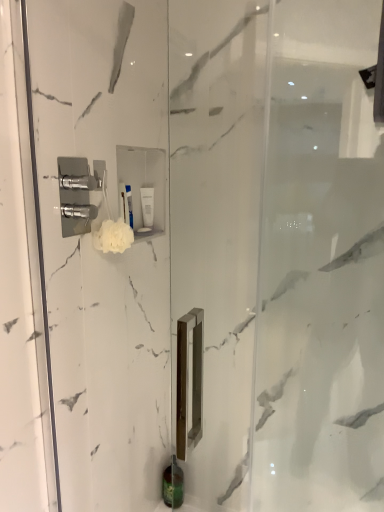
At what (x,y) coordinates should I click in order to perform the action: click on green matte bottle at lower center, the 1th toiletry in the bottom-to-top sequence. Please return your answer as a coordinate pair (x, y). This screenshot has width=384, height=512. Looking at the image, I should click on (173, 485).

You are a GUI agent. You are given a task and a screenshot of the screen. Output one action in this format:
    pyautogui.click(x=<x>, y=<y>)
    Task: Click on the white fluffy sponge at upper center
    The image size is (384, 512).
    Given the screenshot: What is the action you would take?
    pyautogui.click(x=113, y=236)

Find the location of `green matte bottle at lower center, the 1th toiletry from the right`. green matte bottle at lower center, the 1th toiletry from the right is located at coordinates (173, 485).

Which is behind, white matte tube at upper center, the 1th toiletry viewed from the left, or green matte bottle at lower center, placed as the 1th toiletry when sorted from back to front?

Positioned behind is green matte bottle at lower center, placed as the 1th toiletry when sorted from back to front.

Is white matte tube at upper center, which is counted as the second toiletry, starting from the bottom, in contact with green matte bottle at lower center, which appears as the 2th toiletry when viewed from the top?

white matte tube at upper center, which is counted as the second toiletry, starting from the bottom, and green matte bottle at lower center, which appears as the 2th toiletry when viewed from the top, are clearly separated.

Is point (148, 202) closer or farther from the camera than point (177, 488)?

Point (148, 202) is closer to the camera than point (177, 488).

Considering the sizes of white matte tube at upper center, which is counted as the second toiletry, starting from the bottom, and green matte bottle at lower center, placed as the 1th toiletry when sorted from back to front, in the image, is white matte tube at upper center, which is counted as the second toiletry, starting from the bottom, taller or shorter than green matte bottle at lower center, placed as the 1th toiletry when sorted from back to front,?

white matte tube at upper center, which is counted as the second toiletry, starting from the bottom, is taller than green matte bottle at lower center, placed as the 1th toiletry when sorted from back to front.

Find the location of `toiletry that appears above the white fluffy sponge at upper center (from a real-world perspective)`. toiletry that appears above the white fluffy sponge at upper center (from a real-world perspective) is located at coordinates (147, 206).

Can you confirm if white fluffy sponge at upper center is positioned to the left of white matte tube at upper center, the 2th toiletry when ordered from right to left?

Correct, you'll find white fluffy sponge at upper center to the left of white matte tube at upper center, the 2th toiletry when ordered from right to left.

From the image's perspective, between white fluffy sponge at upper center and white matte tube at upper center, the 2th toiletry when ordered from right to left, who is located below?

white fluffy sponge at upper center is shown below in the image.

Consider the image. How many degrees apart are the facing directions of white fluffy sponge at upper center and white matte tube at upper center, which is the second toiletry in back-to-front order?

0.00713 degrees.

From the image's perspective, which is below, green matte bottle at lower center, the 1th toiletry from the right, or white matte tube at upper center, the 1th toiletry viewed from the left?

green matte bottle at lower center, the 1th toiletry from the right, is shown below in the image.

Consider the image. Does green matte bottle at lower center, arranged as the second toiletry when viewed from the front, appear on the left side of white matte tube at upper center, the 2th toiletry when ordered from right to left?

In fact, green matte bottle at lower center, arranged as the second toiletry when viewed from the front, is to the right of white matte tube at upper center, the 2th toiletry when ordered from right to left.

Is green matte bottle at lower center, the 1th toiletry in the bottom-to-top sequence, oriented towards white matte tube at upper center, the 2th toiletry when ordered from right to left?

No.

In the scene shown: From their relative heights in the image, would you say white matte tube at upper center, the 1th toiletry viewed from the left, is taller or shorter than white fluffy sponge at upper center?

Considering their sizes, white matte tube at upper center, the 1th toiletry viewed from the left, has more height than white fluffy sponge at upper center.

Where is `flower below the white matte tube at upper center, the first toiletry in the front-to-back sequence (from a real-world perspective)`? The height and width of the screenshot is (512, 384). flower below the white matte tube at upper center, the first toiletry in the front-to-back sequence (from a real-world perspective) is located at coordinates (113, 236).

Consider the image. Considering the relative positions of white matte tube at upper center, which is the second toiletry in back-to-front order, and white fluffy sponge at upper center in the image provided, is white matte tube at upper center, which is the second toiletry in back-to-front order, to the left of white fluffy sponge at upper center from the viewer's perspective?

Incorrect, white matte tube at upper center, which is the second toiletry in back-to-front order, is not on the left side of white fluffy sponge at upper center.

Is white matte tube at upper center, placed as the 1th toiletry when sorted from top to bottom, oriented away from white fluffy sponge at upper center?

No, white matte tube at upper center, placed as the 1th toiletry when sorted from top to bottom, is not facing the opposite direction of white fluffy sponge at upper center.

Considering the sizes of objects green matte bottle at lower center, placed as the 1th toiletry when sorted from back to front, and white fluffy sponge at upper center in the image provided, who is wider, green matte bottle at lower center, placed as the 1th toiletry when sorted from back to front, or white fluffy sponge at upper center?

Wider between the two is green matte bottle at lower center, placed as the 1th toiletry when sorted from back to front.

Choose the correct answer: Is green matte bottle at lower center, arranged as the second toiletry when viewed from the front, inside white fluffy sponge at upper center or outside it?

The correct answer is: outside.

Looking at this image, who is more distant, green matte bottle at lower center, the 1th toiletry from the right, or white fluffy sponge at upper center?

Positioned behind is green matte bottle at lower center, the 1th toiletry from the right.

In the scene shown: Is green matte bottle at lower center, the 1th toiletry in the bottom-to-top sequence, beside white fluffy sponge at upper center?

There is a gap between green matte bottle at lower center, the 1th toiletry in the bottom-to-top sequence, and white fluffy sponge at upper center.

Which of these two, white fluffy sponge at upper center or green matte bottle at lower center, arranged as the second toiletry when viewed from the front, is bigger?

With larger size is green matte bottle at lower center, arranged as the second toiletry when viewed from the front.

Locate an element on the screen. flower positioned vertically above the green matte bottle at lower center, the 1th toiletry in the bottom-to-top sequence (from a real-world perspective) is located at coordinates (113, 236).

Measure the distance from white fluffy sponge at upper center to green matte bottle at lower center, the 1th toiletry from the right.

A distance of 1.20 meters exists between white fluffy sponge at upper center and green matte bottle at lower center, the 1th toiletry from the right.

Consider the image. Which object is thinner, white fluffy sponge at upper center or green matte bottle at lower center, which is the 2th toiletry in left-to-right order?

white fluffy sponge at upper center.

Where is `toiletry that is behind the white matte tube at upper center, which is counted as the second toiletry, starting from the bottom`? This screenshot has width=384, height=512. toiletry that is behind the white matte tube at upper center, which is counted as the second toiletry, starting from the bottom is located at coordinates (x=173, y=485).

Identify the location of flower that appears in front of the white matte tube at upper center, the 2th toiletry when ordered from right to left. Image resolution: width=384 pixels, height=512 pixels. pos(113,236).

Estimate the real-world distances between objects in this image. Which object is further from white fluffy sponge at upper center, white matte tube at upper center, the first toiletry in the front-to-back sequence, or green matte bottle at lower center, the 1th toiletry in the bottom-to-top sequence?

green matte bottle at lower center, the 1th toiletry in the bottom-to-top sequence, is further to white fluffy sponge at upper center.

Looking at the image, which one is located further to green matte bottle at lower center, arranged as the second toiletry when viewed from the front, white matte tube at upper center, the 2th toiletry when ordered from right to left, or white fluffy sponge at upper center?

Among the two, white fluffy sponge at upper center is located further to green matte bottle at lower center, arranged as the second toiletry when viewed from the front.

Based on their spatial positions, is white fluffy sponge at upper center or white matte tube at upper center, which is the second toiletry in back-to-front order, further from green matte bottle at lower center, which is the 2th toiletry in left-to-right order?

Based on the image, white fluffy sponge at upper center appears to be further to green matte bottle at lower center, which is the 2th toiletry in left-to-right order.

In the scene shown: Which object lies further to the anchor point white fluffy sponge at upper center, green matte bottle at lower center, which is the 2th toiletry in left-to-right order, or white matte tube at upper center, the 1th toiletry viewed from the left?

Among the two, green matte bottle at lower center, which is the 2th toiletry in left-to-right order, is located further to white fluffy sponge at upper center.

Looking at the image, which one is located closer to white matte tube at upper center, the 1th toiletry viewed from the left, green matte bottle at lower center, which is the 2th toiletry in left-to-right order, or white fluffy sponge at upper center?

The object closer to white matte tube at upper center, the 1th toiletry viewed from the left, is white fluffy sponge at upper center.

Estimate the real-world distances between objects in this image. Which object is further from white matte tube at upper center, the 1th toiletry viewed from the left, white fluffy sponge at upper center or green matte bottle at lower center, the 1th toiletry in the bottom-to-top sequence?

green matte bottle at lower center, the 1th toiletry in the bottom-to-top sequence, is further to white matte tube at upper center, the 1th toiletry viewed from the left.

Where is `flower that lies between white matte tube at upper center, which is the second toiletry in back-to-front order, and green matte bottle at lower center, arranged as the second toiletry when viewed from the front, from top to bottom`? flower that lies between white matte tube at upper center, which is the second toiletry in back-to-front order, and green matte bottle at lower center, arranged as the second toiletry when viewed from the front, from top to bottom is located at coordinates (113, 236).